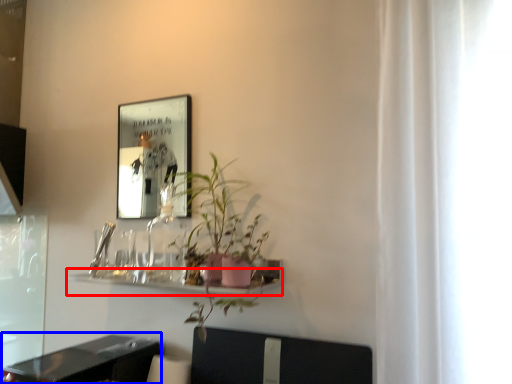
Question: Which object appears closest to the camera in this image, shelf (highlighted by a red box) or table (highlighted by a blue box)?

Choices:
 (A) shelf
 (B) table

Answer: (B)